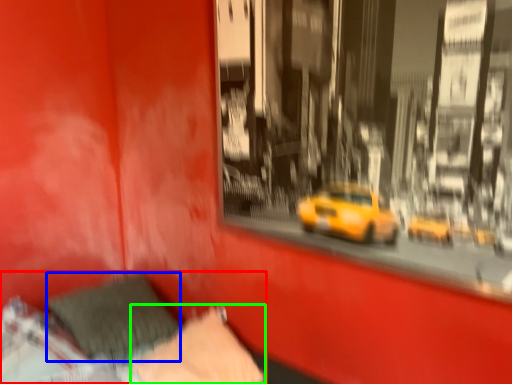
Question: Estimate the real-world distances between objects in this image. Which object is farther from bed (highlighted by a red box), pillow (highlighted by a blue box) or pillow (highlighted by a green box)?

Choices:
 (A) pillow
 (B) pillow

Answer: (B)